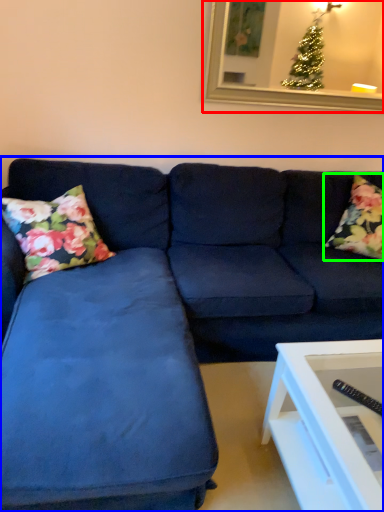
Question: Considering the real-world distances, which object is closest to picture frame (highlighted by a red box)? studio couch (highlighted by a blue box) or pillow (highlighted by a green box).

Choices:
 (A) studio couch
 (B) pillow

Answer: (B)